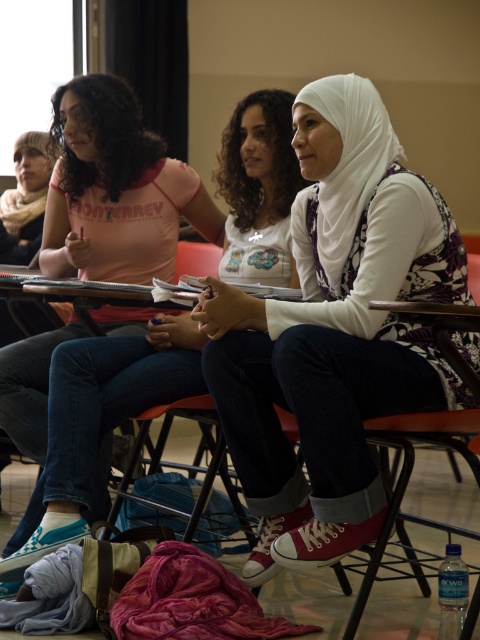
Does white cotton hijab at center have a greater width compared to metallic red chair at center?

Correct, the width of white cotton hijab at center exceeds that of metallic red chair at center.

Can you confirm if white cotton hijab at center is positioned to the left of metallic red chair at center?

Incorrect, white cotton hijab at center is not on the left side of metallic red chair at center.

Is point (326, 298) closer to viewer compared to point (107, 417)?

Yes, it is in front of point (107, 417).

The width and height of the screenshot is (480, 640). Identify the location of white cotton hijab at center. (335, 332).